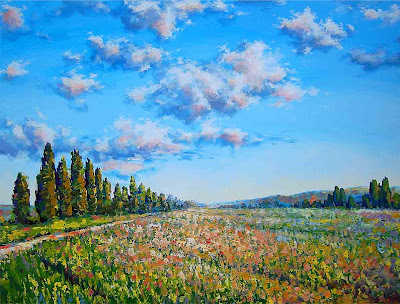
I want to click on painting, so click(196, 36).